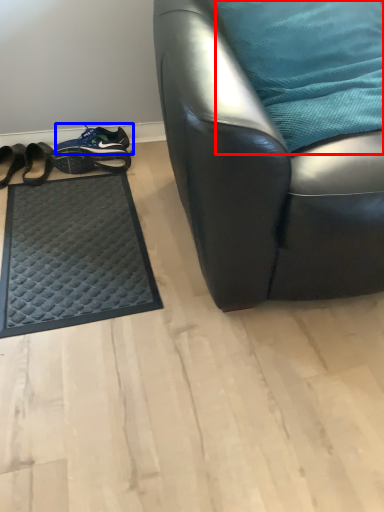
Question: Which of the following is the closest to the observer, pillow (highlighted by a red box) or footwear (highlighted by a blue box)?

Choices:
 (A) pillow
 (B) footwear

Answer: (A)